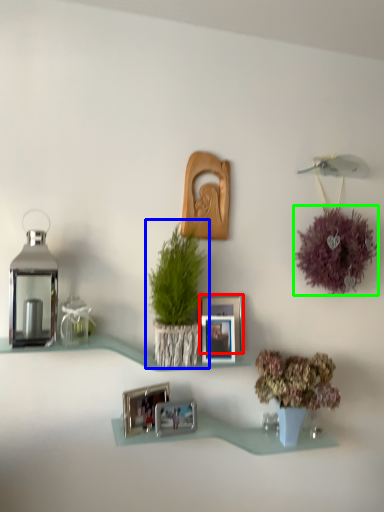
Question: Estimate the real-world distances between objects in this image. Which object is farther from picture frame (highlighted by a red box), houseplant (highlighted by a blue box) or flower (highlighted by a green box)?

Choices:
 (A) houseplant
 (B) flower

Answer: (B)